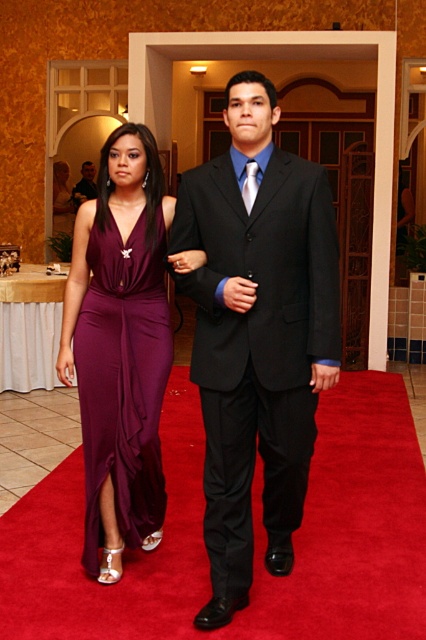
In the scene shown: You are a photographer standing at the origin point of the coordinate system. You need to position yourself to capture the matte purple satin dress at center. What are the coordinates where you should aim your camera?

The coordinates to aim your camera are at point (123, 380) to capture the matte purple satin dress at center.

You are a photographer at the event and want to capture both the matte purple satin dress at center and the matte black suit at center in a single frame. Based on their positions, which one should you focus on first to ensure both are in the shot?

The matte purple satin dress at center is to the right of the matte black suit at center, so you should focus on the matte black suit at center first to ensure both are included in the frame.

You are a photographer positioned at the back of the red carpet. You want to capture a photo of both the black satin suit at center and the matte purple satin dress at center in the same frame. The camera you are using has a minimum focus distance of 18 inches. Can you take the photo without moving closer?

The distance between the black satin suit at center and the matte purple satin dress at center is 18.10 inches. Since the camera requires a minimum focus distance of 18 inches, the photographer can take the photo without moving closer as the distance is sufficient.